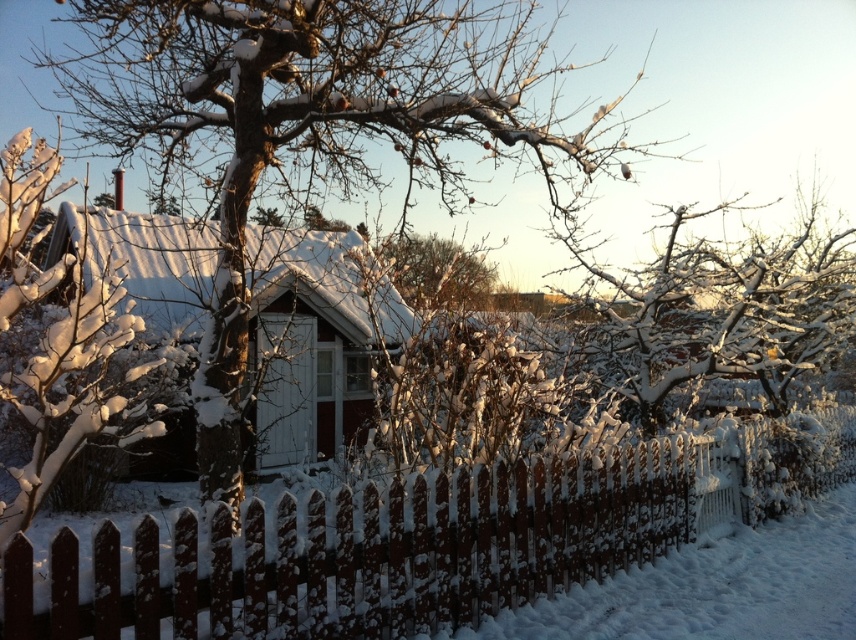
Question: Among these objects, which one is farthest from the camera?

Choices:
 (A) snow-covered tree at center
 (B) white picket fence at center
 (C) white snow-covered tree at left
 (D) white frosty branches at center

Answer: (D)

Question: Is white picket fence at center smaller than red wooden hut at center?

Choices:
 (A) no
 (B) yes

Answer: (B)

Question: Does white picket fence at center come behind white snow-covered tree at left?

Choices:
 (A) no
 (B) yes

Answer: (A)

Question: Estimate the real-world distances between objects in this image. Which object is farther from the snow-covered tree at center?

Choices:
 (A) white picket fence at center
 (B) white snow-covered tree at left
 (C) red wooden hut at center

Answer: (C)

Question: Is red wooden hut at center closer to camera compared to white snow-covered tree at left?

Choices:
 (A) yes
 (B) no

Answer: (B)

Question: Among these points, which one is farthest from the camera?

Choices:
 (A) (314, 452)
 (B) (171, 573)
 (C) (102, 435)
 (D) (483, 300)

Answer: (D)